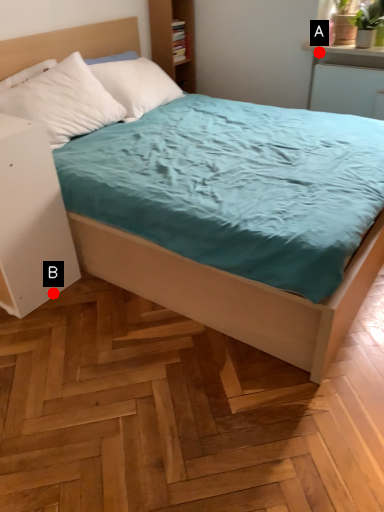
Question: Two points are circled on the image, labeled by A and B beside each circle. Which point is farther from the camera taking this photo?

Choices:
 (A) A is further
 (B) B is further

Answer: (A)